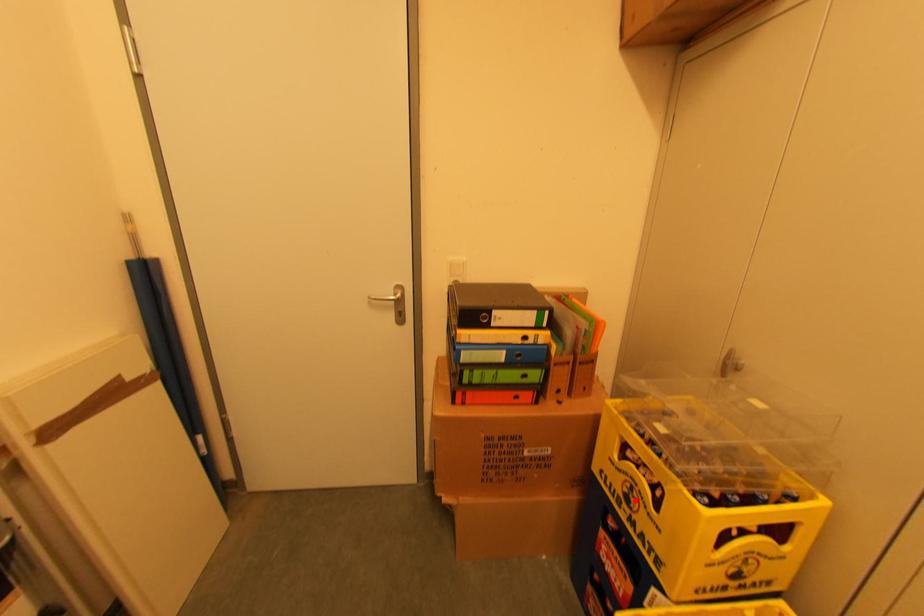
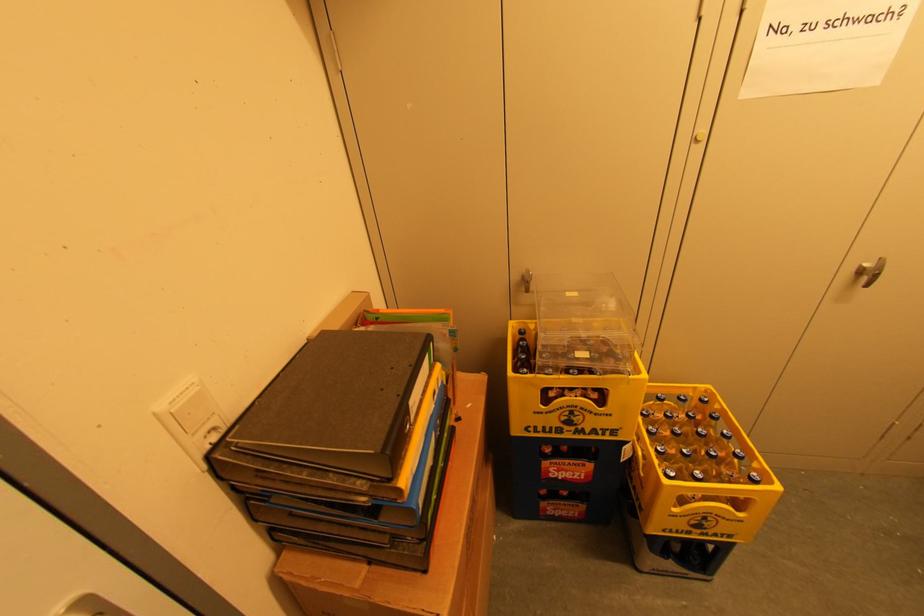
Question: I am providing you with two images of the same scene from different viewpoints. Image1 has a red point marked. In image2, the corresponding 3D location appears at what relative position? Reply with the corresponding letter.

Choices:
 (A) Closer
 (B) Farther

Answer: (B)